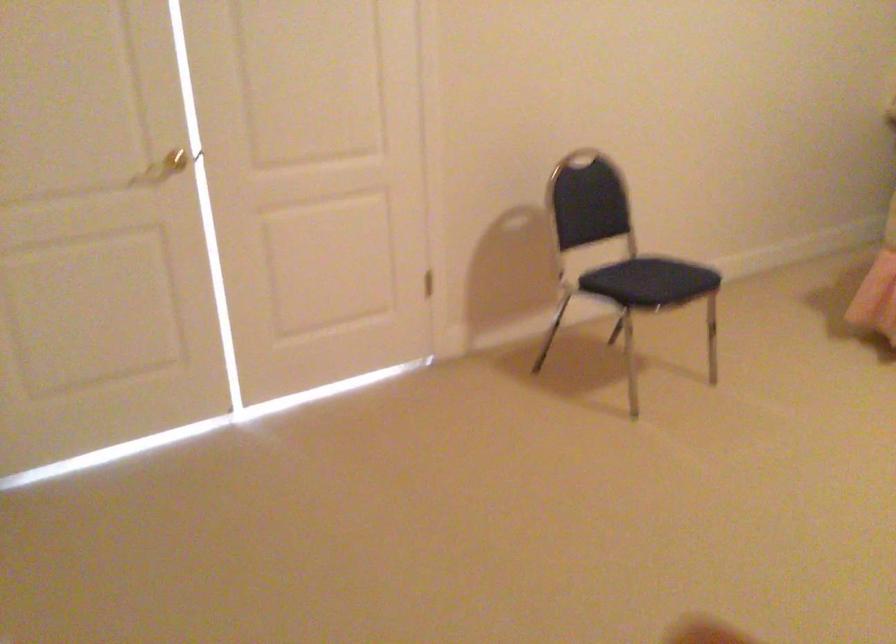
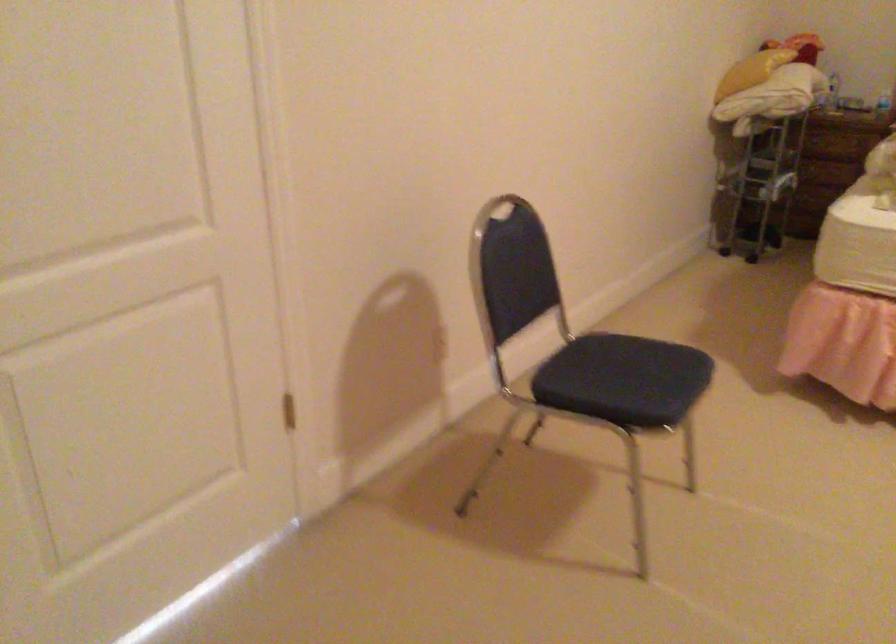
What movement of the cameraman would produce the second image?

The cameraman walked toward left, forward.